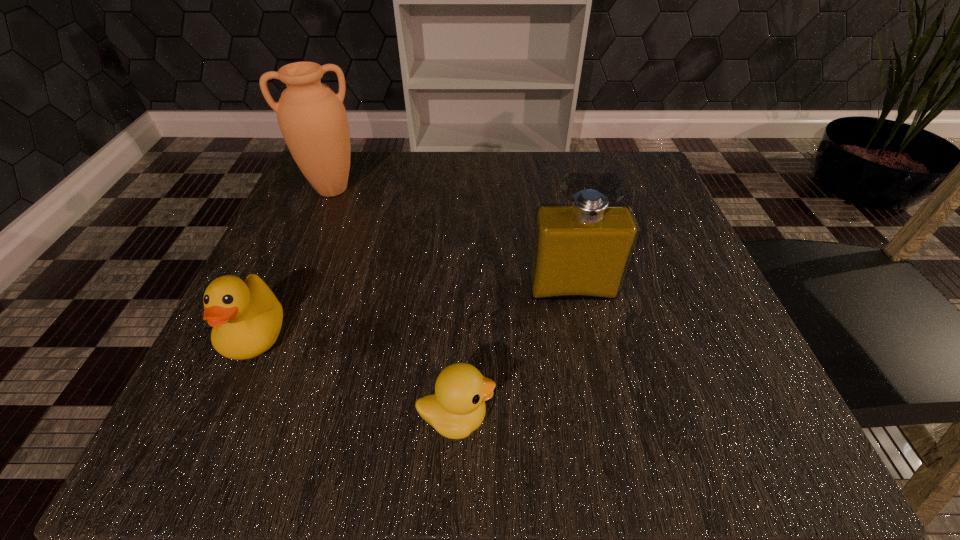
Where is `free space between the rightmost object and the shorter duck`? free space between the rightmost object and the shorter duck is located at coordinates (514, 353).

The width and height of the screenshot is (960, 540). I want to click on free space that is in between the rightmost object and the urn, so click(452, 239).

Find the location of a particular element. The image size is (960, 540). free space between the left duck and the second farthest object is located at coordinates (414, 312).

Locate an element on the screen. the closest object to the left duck is located at coordinates (457, 408).

Locate an element on the screen. This screenshot has width=960, height=540. the second closest object relative to the second farthest object is located at coordinates (246, 318).

Locate an element on the screen. blank area in the image that satisfies the following two spatial constraints: 1. on the front-facing side of the third shortest object; 2. on the face of the nearest object is located at coordinates (598, 418).

Find the location of `vacant position in the image that satisfies the following two spatial constraints: 1. on the front-facing side of the perfume; 2. on the face of the nearer duck`. vacant position in the image that satisfies the following two spatial constraints: 1. on the front-facing side of the perfume; 2. on the face of the nearer duck is located at coordinates (598, 418).